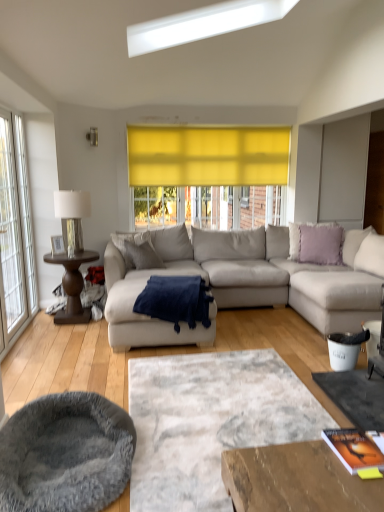
Question: Should I look upward or downward to see clear glass window at left?

Choices:
 (A) down
 (B) up

Answer: (B)

Question: Can you confirm if clear glass window at left is positioned to the right of textured gray rug at center?

Choices:
 (A) yes
 (B) no

Answer: (B)

Question: From a real-world perspective, does clear glass window at left stand above textured gray rug at center?

Choices:
 (A) yes
 (B) no

Answer: (A)

Question: Is clear glass window at left at the left side of textured gray rug at center?

Choices:
 (A) no
 (B) yes

Answer: (B)

Question: Is clear glass window at left thinner than textured gray rug at center?

Choices:
 (A) no
 (B) yes

Answer: (B)

Question: From the image's perspective, would you say clear glass window at left is shown under textured gray rug at center?

Choices:
 (A) yes
 (B) no

Answer: (B)

Question: Considering the relative positions of clear glass window at left and textured gray rug at center in the image provided, is clear glass window at left in front of textured gray rug at center?

Choices:
 (A) yes
 (B) no

Answer: (B)

Question: Can you confirm if navy blue plush blanket at center is taller than lavender soft cushion at upper right, marked as the 2th pillow in a left-to-right arrangement?

Choices:
 (A) no
 (B) yes

Answer: (A)

Question: Considering the relative sizes of navy blue plush blanket at center and lavender soft cushion at upper right, the 1th pillow in the right-to-left sequence, in the image provided, is navy blue plush blanket at center smaller than lavender soft cushion at upper right, the 1th pillow in the right-to-left sequence,?

Choices:
 (A) no
 (B) yes

Answer: (A)

Question: Is navy blue plush blanket at center touching lavender soft cushion at upper right, marked as the 2th pillow in a left-to-right arrangement?

Choices:
 (A) yes
 (B) no

Answer: (B)

Question: Does navy blue plush blanket at center contain lavender soft cushion at upper right, the 1th pillow in the right-to-left sequence?

Choices:
 (A) no
 (B) yes

Answer: (A)

Question: Considering the relative positions of navy blue plush blanket at center and lavender soft cushion at upper right, marked as the 2th pillow in a left-to-right arrangement, in the image provided, is navy blue plush blanket at center to the left of lavender soft cushion at upper right, marked as the 2th pillow in a left-to-right arrangement, from the viewer's perspective?

Choices:
 (A) no
 (B) yes

Answer: (B)

Question: Is navy blue plush blanket at center at the right side of lavender soft cushion at upper right, marked as the 2th pillow in a left-to-right arrangement?

Choices:
 (A) yes
 (B) no

Answer: (B)

Question: Is light gray fabric couch at center behind gray fabric pillow at center, which is the 2th pillow from right to left?

Choices:
 (A) yes
 (B) no

Answer: (B)